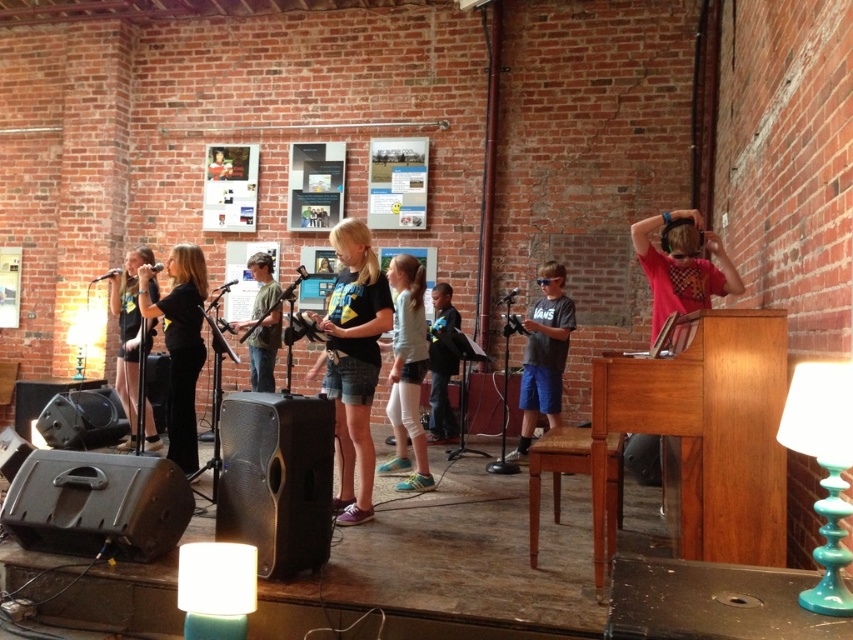
Question: Which point is farther to the camera?

Choices:
 (A) (396, 353)
 (B) (683, 307)
 (C) (569, 323)

Answer: (C)

Question: Observing the image, what is the correct spatial positioning of black matte shirt at center in reference to matte gray t-shirt at center?

Choices:
 (A) right
 (B) left

Answer: (B)

Question: Can you confirm if white matte leggings at center is thinner than green cotton shirt at center?

Choices:
 (A) no
 (B) yes

Answer: (B)

Question: Which point is farther from the camera taking this photo?

Choices:
 (A) (x=276, y=339)
 (B) (x=434, y=394)
 (C) (x=618, y=465)

Answer: (B)

Question: Considering the relative positions of black matte shirt at center and green cotton shirt at center in the image provided, where is black matte shirt at center located with respect to green cotton shirt at center?

Choices:
 (A) below
 (B) above

Answer: (A)

Question: Based on their relative distances, which object is nearer to the blue denim jeans at center?

Choices:
 (A) light brown wooden stool at center
 (B) green cotton shirt at center
 (C) white matte leggings at center
 (D) matte gray t-shirt at center

Answer: (D)